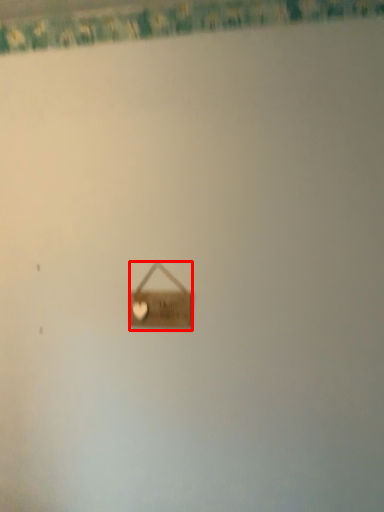
Question: From the image's perspective, where is handbag (annotated by the red box) located in relation to curtain in the image?

Choices:
 (A) above
 (B) below

Answer: (B)